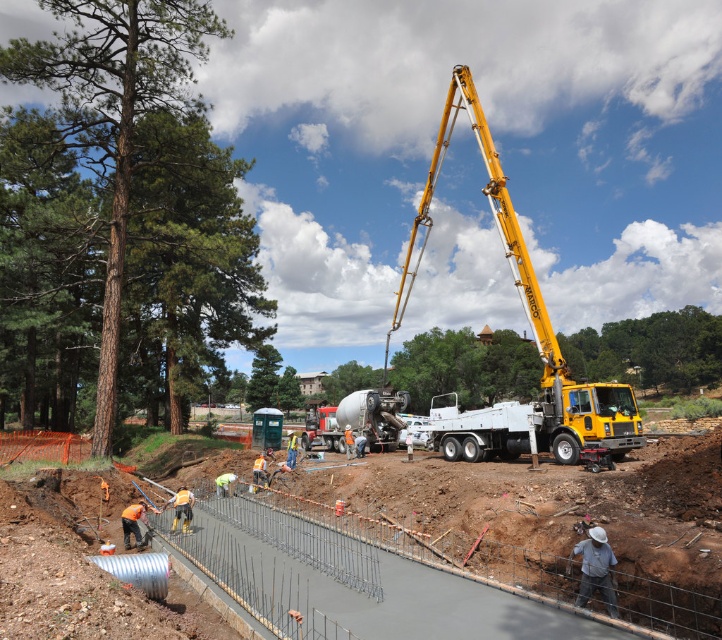
You are standing at the crane on the right side of the construction site. You need to move to the white metallic truck at center. Which direction should you walk to reach it?

You should walk towards the center of the construction site to reach the white metallic truck at center.

You are a construction inspector standing at point (539, 422). You need to check the stability of the white metallic truck at center. Is the truck located at your current position?

The white metallic truck at center is located at point (539, 422), so yes, the truck is at your current position.